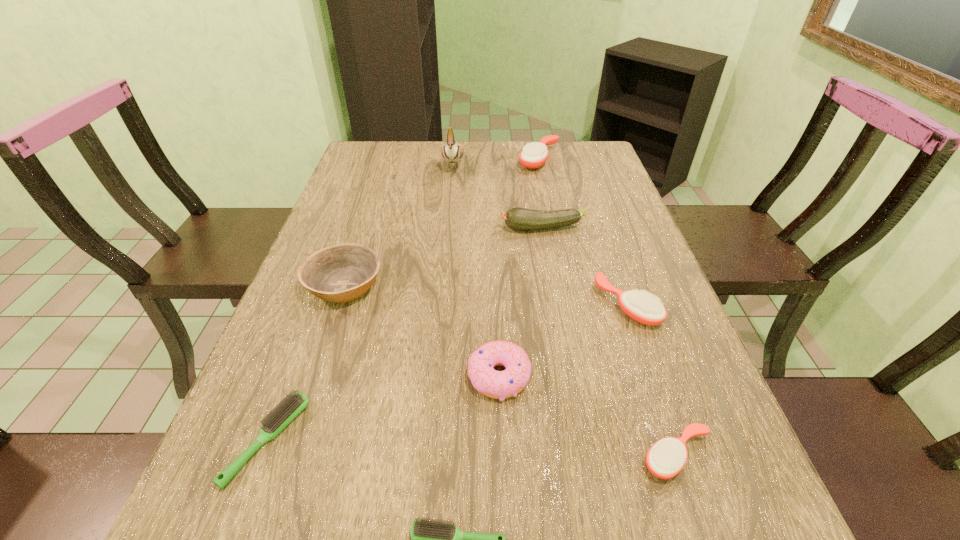
Where is `the fourth tallest hairbrush`? Image resolution: width=960 pixels, height=540 pixels. the fourth tallest hairbrush is located at coordinates (277, 419).

Where is `the leftmost hairbrush`? the leftmost hairbrush is located at coordinates (277, 419).

Locate an element on the screen. The height and width of the screenshot is (540, 960). free location located at the face of the bird is located at coordinates (446, 246).

At what (x,y) coordinates should I click in order to perform the action: click on free spot located 0.210m on the left of the biggest orange hairbrush. Please return your answer as a coordinate pair (x, y). The width and height of the screenshot is (960, 540). Looking at the image, I should click on (455, 159).

At what (x,y) coordinates should I click in order to perform the action: click on vacant space situated 0.080m at the blossom end of the zucchini. Please return your answer as a coordinate pair (x, y). The height and width of the screenshot is (540, 960). Looking at the image, I should click on [x=468, y=228].

What are the coordinates of `free location located 0.200m at the blossom end of the zucchini` in the screenshot? It's located at (423, 228).

Where is `free spot located 0.210m at the blossom end of the zucchini`? Image resolution: width=960 pixels, height=540 pixels. free spot located 0.210m at the blossom end of the zucchini is located at coordinates (420, 228).

Locate an element on the screen. The width and height of the screenshot is (960, 540). free space located on the right of the bowl is located at coordinates (505, 286).

This screenshot has height=540, width=960. In order to click on free location located 0.180m on the right of the doughnut in this screenshot , I will do `click(625, 376)`.

Locate an element on the screen. free space located 0.140m on the back of the second farthest hairbrush is located at coordinates (607, 245).